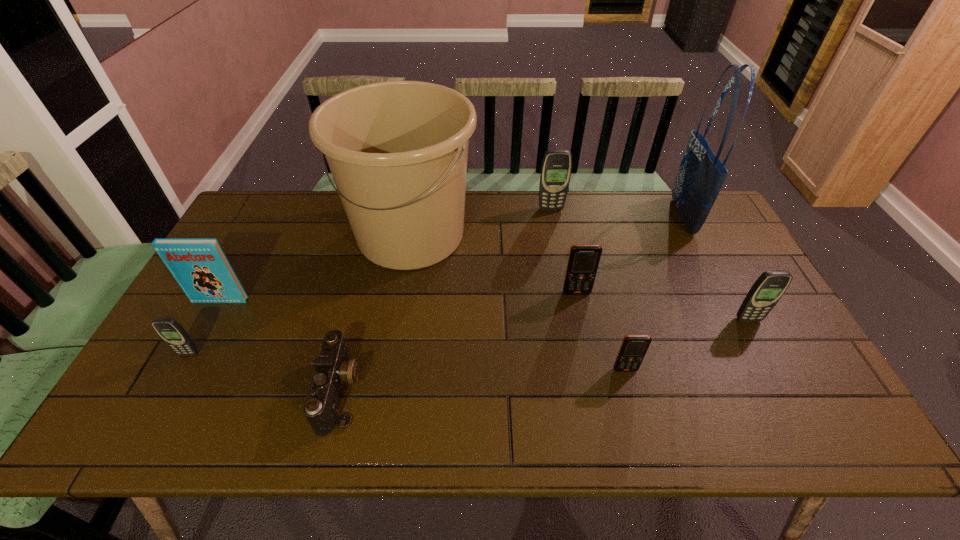
Image resolution: width=960 pixels, height=540 pixels. What are the coordinates of `vacant area that lies between the farthest cellular telephone and the camera` in the screenshot? It's located at (445, 300).

This screenshot has width=960, height=540. In order to click on object that is the second closest to the shortest object in this screenshot , I will do pyautogui.click(x=201, y=268).

Where is `object that is the fourth closest to the sixth farthest object`? object that is the fourth closest to the sixth farthest object is located at coordinates (556, 168).

Locate an element on the screen. The height and width of the screenshot is (540, 960). cellular telephone that stands as the fourth closest to the shortest object is located at coordinates (556, 168).

Choose which cellular telephone is the third nearest neighbor to the leftmost gray cellular telephone. Please provide its 2D coordinates. Your answer should be formatted as a tuple, i.e. [(x, y)], where the tuple contains the x and y coordinates of a point satisfying the conditions above.

[(556, 168)]

At what (x,y) coordinates should I click in order to perform the action: click on gray cellular telephone that stands as the closest to the biggest gray cellular telephone. Please return your answer as a coordinate pair (x, y). The height and width of the screenshot is (540, 960). Looking at the image, I should click on (767, 290).

Image resolution: width=960 pixels, height=540 pixels. I want to click on gray cellular telephone that is the nearest to the biggest gray cellular telephone, so click(x=767, y=290).

Image resolution: width=960 pixels, height=540 pixels. In order to click on vacant area that satisfies the following two spatial constraints: 1. on the screen of the bigger orange cellular telephone; 2. on the front-facing side of the shortest object in this screenshot , I will do `click(597, 391)`.

Where is `vacant space that satisfies the following two spatial constraints: 1. on the screen of the smaller orange cellular telephone; 2. on the front-facing side of the camera`? vacant space that satisfies the following two spatial constraints: 1. on the screen of the smaller orange cellular telephone; 2. on the front-facing side of the camera is located at coordinates (631, 391).

The image size is (960, 540). In order to click on free region that satisfies the following two spatial constraints: 1. on the front-facing side of the shopping bag; 2. on the screen of the leftmost cellular telephone in this screenshot , I will do `click(753, 354)`.